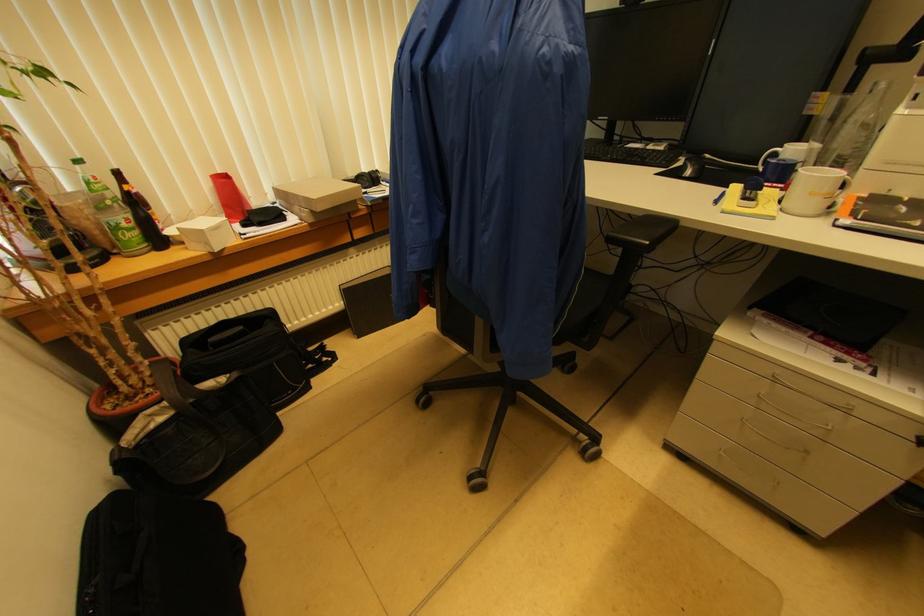
The image size is (924, 616). What do you see at coordinates (641, 232) in the screenshot? I see `the chair armest` at bounding box center [641, 232].